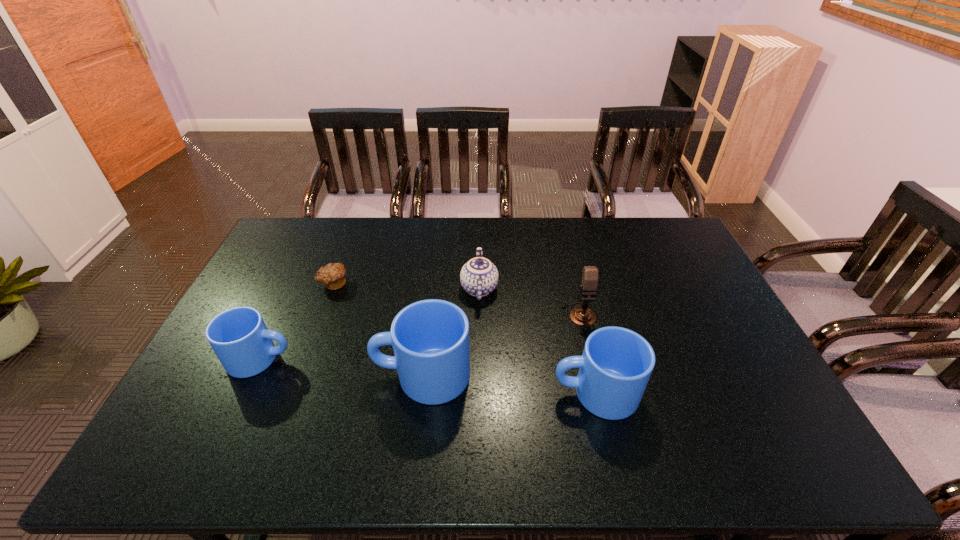
What are the coordinates of `object that is the closest to the microphone` in the screenshot? It's located at (614, 369).

Find the location of a particular element. the closest mug relative to the leftmost mug is located at coordinates (x=430, y=338).

Select which mug is the second closest to the chinaware. Please provide its 2D coordinates. Your answer should be formatted as a tuple, i.e. [(x, y)], where the tuple contains the x and y coordinates of a point satisfying the conditions above.

[(614, 369)]

Locate an element on the screen. vacant position in the image that satisfies the following two spatial constraints: 1. on the front-facing side of the microphone; 2. on the side of the second mug from left to right with the handle is located at coordinates (593, 375).

At what (x,y) coordinates should I click in order to perform the action: click on vacant space that satisfies the following two spatial constraints: 1. on the front-facing side of the microphone; 2. on the side of the second mug from left to right with the handle. Please return your answer as a coordinate pair (x, y). This screenshot has height=540, width=960. Looking at the image, I should click on (593, 375).

Find the location of a particular element. The image size is (960, 540). free location that satisfies the following two spatial constraints: 1. on the front-facing side of the microphone; 2. on the side of the second mug from left to right with the handle is located at coordinates (593, 375).